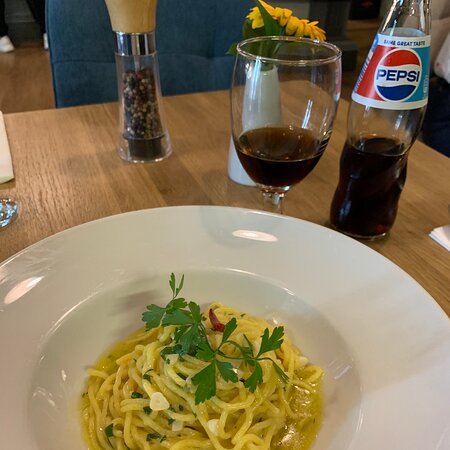
The width and height of the screenshot is (450, 450). What are the coordinates of `1 wooden table` in the screenshot? It's located at (70, 163).